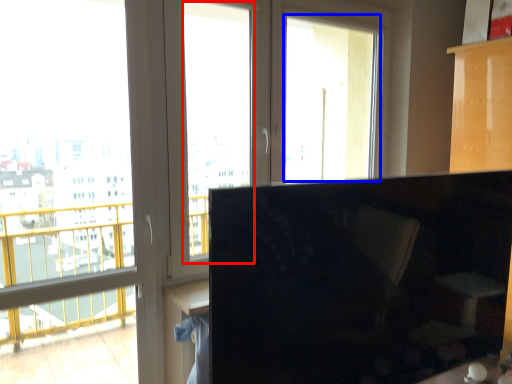
Question: Which point is further to the camera, window screen (highlighted by a red box) or window screen (highlighted by a blue box)?

Choices:
 (A) window screen
 (B) window screen

Answer: (B)